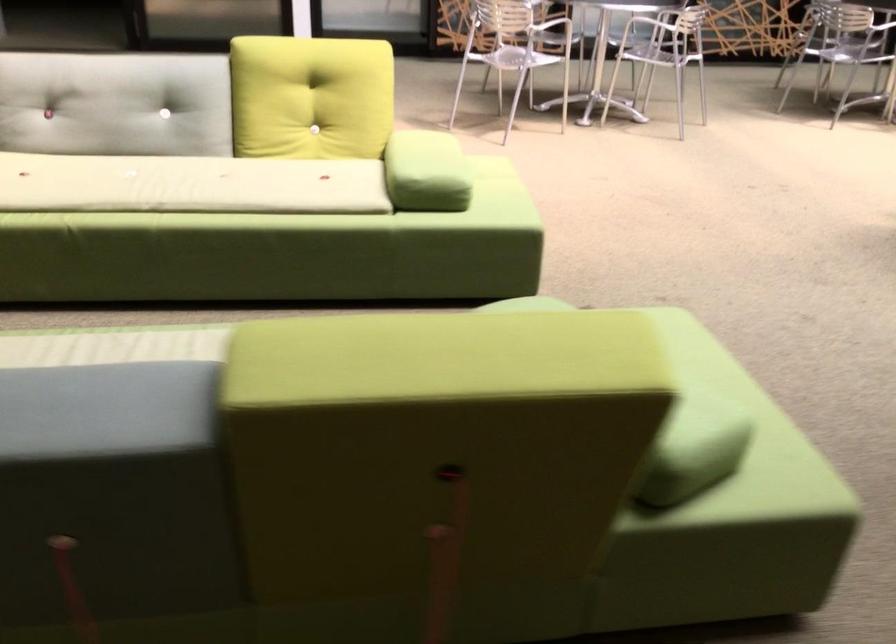
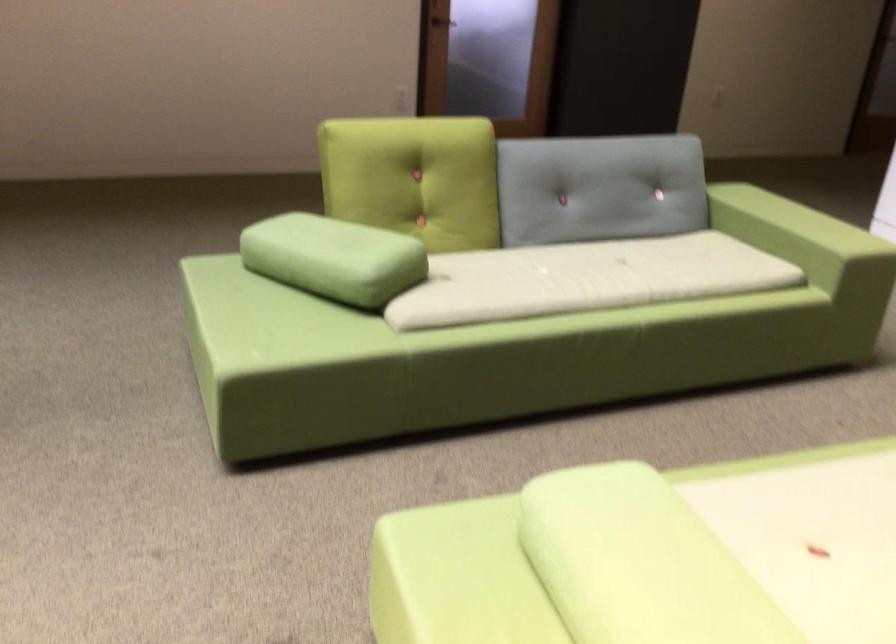
Find the pixel in the second image that matches the point at 432,146 in the first image.

(639, 563)